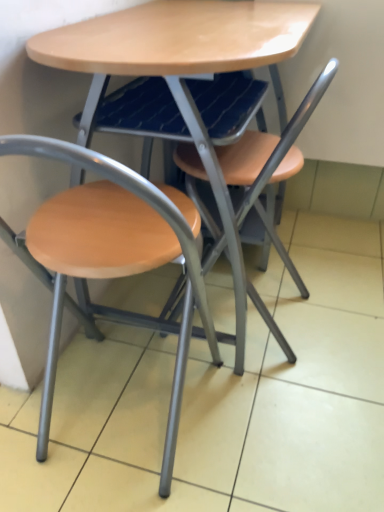
Question: Could you tell me if matte wood table at center is facing wooden seat at center, positioned as the first chair in right-to-left order?

Choices:
 (A) yes
 (B) no

Answer: (A)

Question: Considering the relative sizes of matte wood table at center and wooden seat at center, acting as the second chair starting from the left, in the image provided, is matte wood table at center smaller than wooden seat at center, acting as the second chair starting from the left,?

Choices:
 (A) no
 (B) yes

Answer: (A)

Question: Does matte wood table at center have a larger size compared to wooden seat at center, acting as the second chair starting from the left?

Choices:
 (A) yes
 (B) no

Answer: (A)

Question: Is matte wood table at center outside wooden seat at center, positioned as the first chair in right-to-left order?

Choices:
 (A) no
 (B) yes

Answer: (B)

Question: Is matte wood table at center to the right of wooden seat at center, positioned as the first chair in right-to-left order, from the viewer's perspective?

Choices:
 (A) no
 (B) yes

Answer: (A)

Question: Is point (215, 181) closer or farther from the camera than point (177, 88)?

Choices:
 (A) farther
 (B) closer

Answer: (A)

Question: In terms of width, does wooden seat at center, positioned as the first chair in right-to-left order, look wider or thinner when compared to matte wood table at center?

Choices:
 (A) wide
 (B) thin

Answer: (B)

Question: From a real-world perspective, is wooden seat at center, positioned as the first chair in right-to-left order, positioned above or below matte wood table at center?

Choices:
 (A) below
 (B) above

Answer: (A)

Question: From the image's perspective, is wooden seat at center, acting as the second chair starting from the left, above or below matte wood table at center?

Choices:
 (A) above
 (B) below

Answer: (B)

Question: Is point (177, 35) positioned closer to the camera than point (148, 190)?

Choices:
 (A) farther
 (B) closer

Answer: (A)

Question: Choose the correct answer: Is matte wood table at center inside matte wood chair at left, which is counted as the second chair, starting from the right, or outside it?

Choices:
 (A) inside
 (B) outside

Answer: (B)

Question: In the image, is matte wood table at center positioned in front of or behind matte wood chair at left, marked as the first chair in a left-to-right arrangement?

Choices:
 (A) front
 (B) behind

Answer: (B)

Question: Considering the positions of matte wood table at center and matte wood chair at left, which is counted as the second chair, starting from the right, in the image, is matte wood table at center wider or thinner than matte wood chair at left, which is counted as the second chair, starting from the right,?

Choices:
 (A) wide
 (B) thin

Answer: (A)

Question: Is matte wood chair at left, which is counted as the second chair, starting from the right, in front of or behind matte wood table at center in the image?

Choices:
 (A) behind
 (B) front

Answer: (B)

Question: Considering the positions of point (168, 424) and point (206, 164), is point (168, 424) closer or farther from the camera than point (206, 164)?

Choices:
 (A) closer
 (B) farther

Answer: (B)